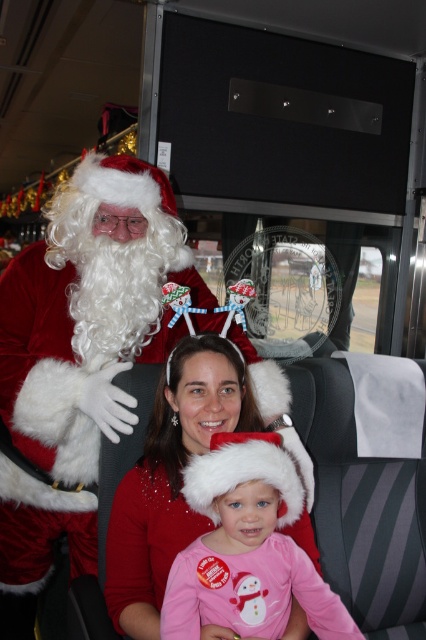
Question: Does velvet santa claus at upper left appear on the left side of pink fleece hat at center?

Choices:
 (A) no
 (B) yes

Answer: (B)

Question: Can you confirm if velvet santa claus at upper left is wider than matte red sweater at center?

Choices:
 (A) no
 (B) yes

Answer: (B)

Question: Which object is positioned farthest from the velvet santa claus at upper left?

Choices:
 (A) matte red sweater at center
 (B) pink fleece hat at center

Answer: (B)

Question: Is velvet santa claus at upper left smaller than pink fleece hat at center?

Choices:
 (A) no
 (B) yes

Answer: (A)

Question: Among these points, which one is farthest from the camera?

Choices:
 (A) (178, 364)
 (B) (273, 484)

Answer: (A)

Question: Estimate the real-world distances between objects in this image. Which object is closer to the velvet santa claus at upper left?

Choices:
 (A) matte red sweater at center
 (B) pink fleece hat at center

Answer: (A)